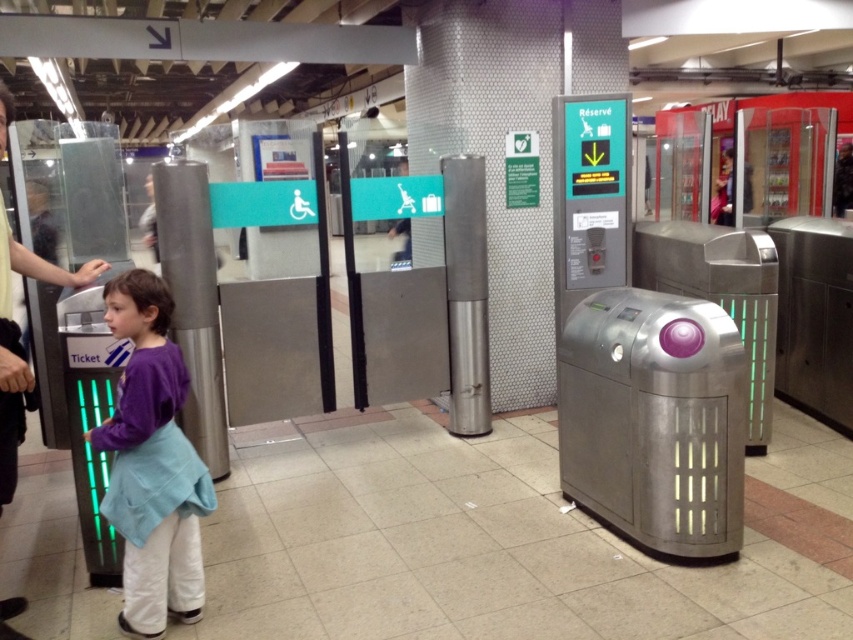
You are a fashion designer observing two people in a subway station. You notice a purple fabric dress at left and a dark gray shirt at left. Which clothing item is shorter in height?

The purple fabric dress at left has a lesser height compared to the dark gray shirt at left, so the purple fabric dress at left is shorter in height.

You are a photographer standing in the subway station. You see the purple fabric dress at left and the silver metallic pillar at center. Which object is closer to the right side of the pillar?

The purple fabric dress at left is positioned on the right side of the silver metallic pillar at center, so it is closer to the right side of the pillar.

You are standing in a subway station and need to reach the ticket machine to validate your ticket. You see a silver metallic pillar at center and a dark gray shirt at left. Which object is closer to you if you are facing the turnstiles?

The dark gray shirt at left is closer to you because it is only 34.51 inches away from the silver metallic pillar at center, but since you are facing the turnstiles, the shirt is positioned to your left, making it closer than the pillar which is at the center.